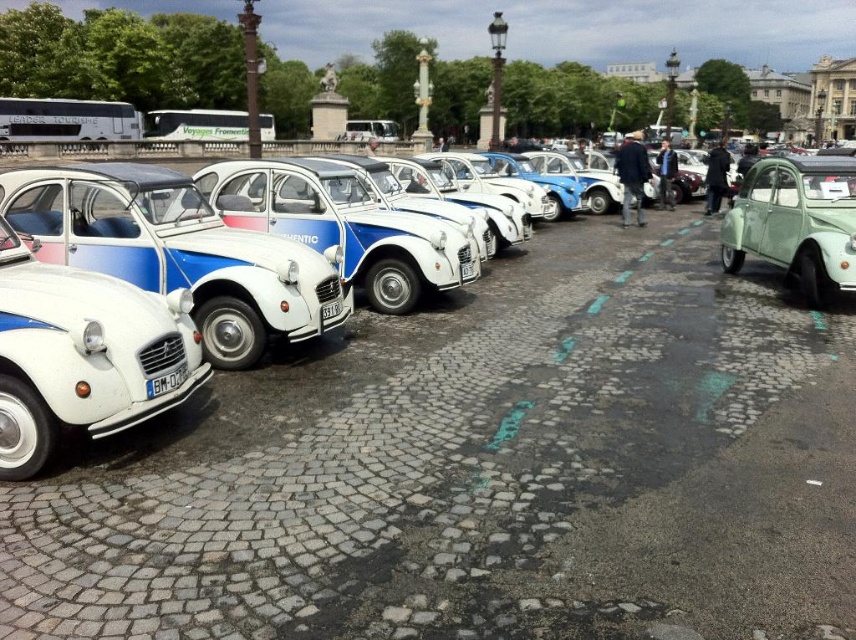
Question: Is white matte vintage car at center to the right of white matte car at center from the viewer's perspective?

Choices:
 (A) no
 (B) yes

Answer: (B)

Question: Which object is farther from the camera taking this photo?

Choices:
 (A) matte green car at right
 (B) white matte car at center
 (C) white matte vintage car at left

Answer: (A)

Question: Which object appears closest to the camera in this image?

Choices:
 (A) matte green car at right
 (B) white matte vintage car at center
 (C) white matte vintage car at left
 (D) white matte car at center

Answer: (C)

Question: In this image, where is white matte vintage car at center located relative to matte green car at right?

Choices:
 (A) left
 (B) right

Answer: (A)

Question: Is white matte vintage car at center to the right of white matte vintage car at left from the viewer's perspective?

Choices:
 (A) no
 (B) yes

Answer: (A)

Question: Which of the following is the farthest from the observer?

Choices:
 (A) (97, 412)
 (B) (831, 285)
 (C) (336, 337)

Answer: (B)